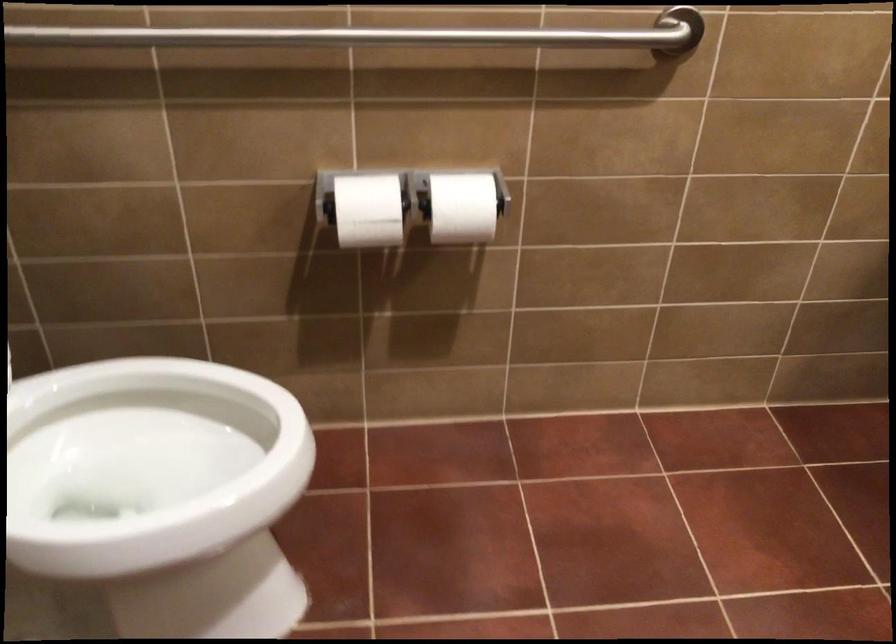
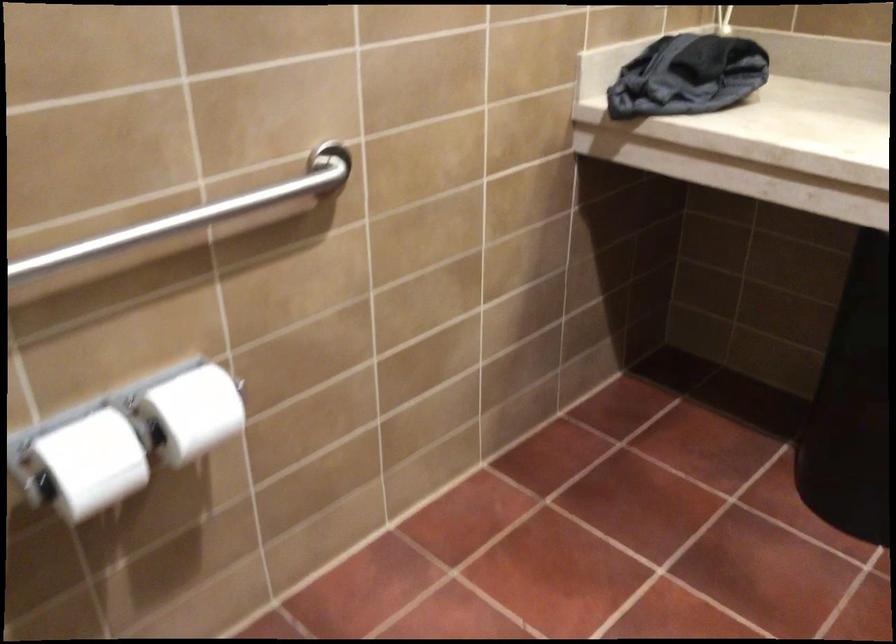
Question: The images are taken continuously from a first-person perspective. In which direction is your viewpoint rotating?

Choices:
 (A) Left
 (B) Right
 (C) Up
 (D) Down

Answer: (B)